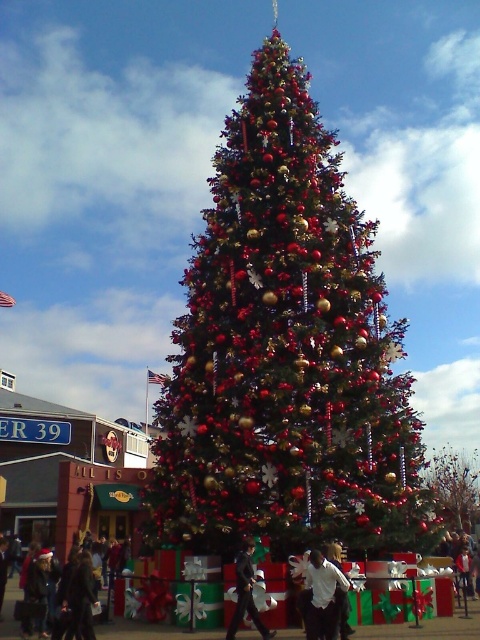
You are standing at the base of the Christmas tree and want to take a photo of the dark gray suit at center. Where should you aim your camera to capture it?

You should aim your camera at point (343, 614) to capture the dark gray suit at center.

You are attending a Christmas event and see a man wearing a black suit at center and a white cotton shirt at center near the Christmas tree. Which piece of clothing is closer to you?

The black suit at center is closer to the viewer than the white cotton shirt at center.

You are attending a Christmas event and see a man wearing a black suit at center and a white cotton shirt at center. From your perspective, which clothing item is positioned to the left?

The black suit at center is positioned to the left of the white cotton shirt at center.